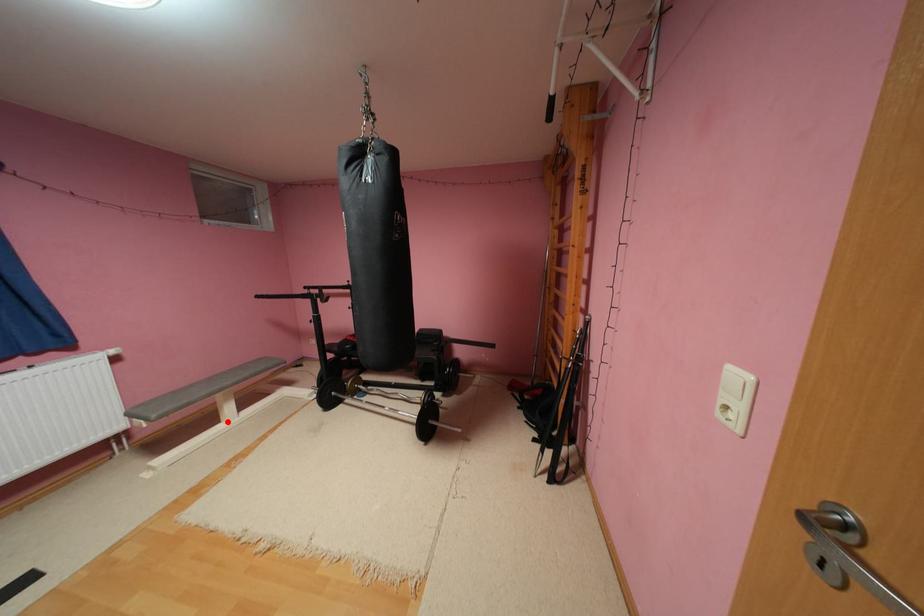
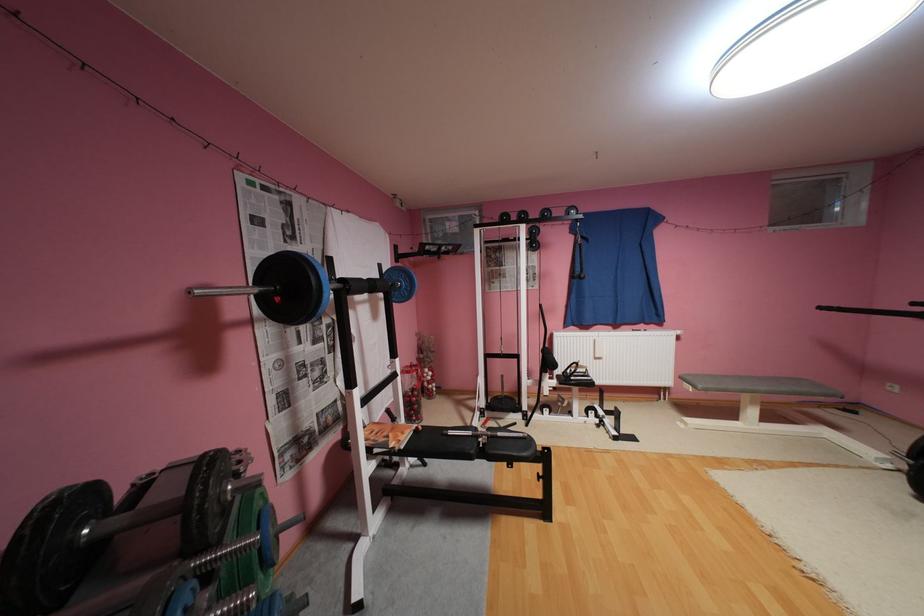
Question: I am providing you with two images of the same scene from different viewpoints. Image1 has a red point marked. In image2, the corresponding 3D location appears at what relative position? Reply with the corresponding letter.

Choices:
 (A) Closer
 (B) Farther

Answer: (A)